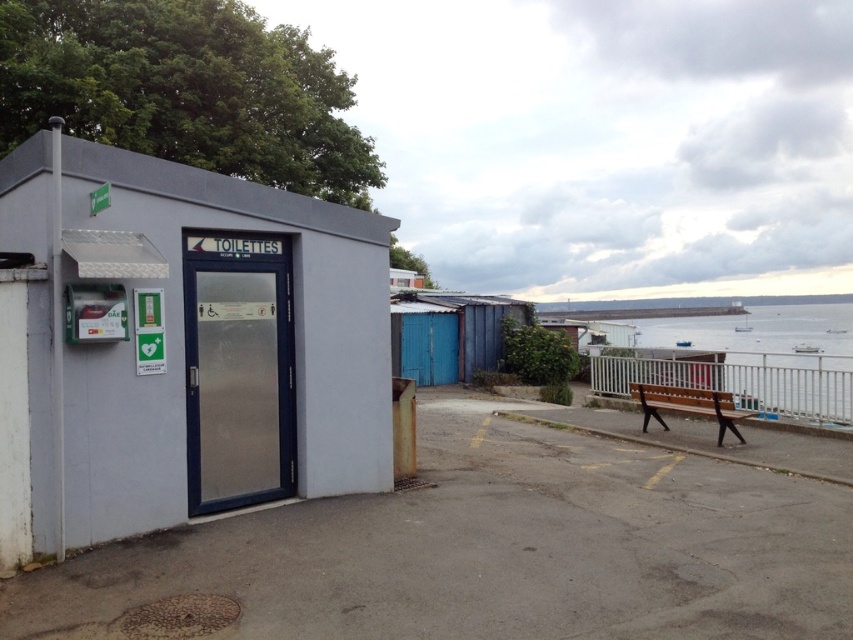
You are a maintenance worker who needs to place a new 2.5 meter tall air conditioning unit on the ground. You see the blue corrugated metal shed at center and the wooden bench at lower right. Which object can the air conditioning unit be placed next to without blocking the shed?

The blue corrugated metal shed at center is taller than the wooden bench at lower right. Since the air conditioning unit is 2.5 meters tall, it should be placed next to the wooden bench at lower right to avoid blocking the shed.

You are a maintenance worker needing to place a 2.5 meter wide equipment between the clear water at bench right and the blue corrugated metal shed at center. Can the equipment fit between them?

The clear water at bench right is wider than the blue corrugated metal shed at center. Therefore, the equipment with 2.5 meter width can fit between them as the combined width of both objects allows enough space.